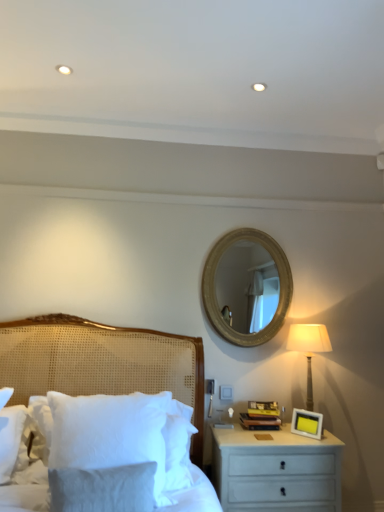
Question: Can you confirm if white painted wood nightstand at lower right is taller than white woven bed at left?

Choices:
 (A) no
 (B) yes

Answer: (A)

Question: Considering the relative positions of white painted wood nightstand at lower right and white woven bed at left in the image provided, is white painted wood nightstand at lower right behind white woven bed at left?

Choices:
 (A) no
 (B) yes

Answer: (B)

Question: Does white painted wood nightstand at lower right have a lesser width compared to white woven bed at left?

Choices:
 (A) yes
 (B) no

Answer: (B)

Question: Is white painted wood nightstand at lower right facing towards white woven bed at left?

Choices:
 (A) no
 (B) yes

Answer: (A)

Question: Does white painted wood nightstand at lower right appear on the left side of white woven bed at left?

Choices:
 (A) yes
 (B) no

Answer: (B)

Question: From a real-world perspective, relative to white fluffy pillow at lower left, is gold textured mirror at upper center vertically above or below?

Choices:
 (A) below
 (B) above

Answer: (B)

Question: Considering the relative positions of gold textured mirror at upper center and white fluffy pillow at lower left in the image provided, is gold textured mirror at upper center to the left or to the right of white fluffy pillow at lower left?

Choices:
 (A) left
 (B) right

Answer: (B)

Question: Considering the positions of gold textured mirror at upper center and white fluffy pillow at lower left in the image, is gold textured mirror at upper center wider or thinner than white fluffy pillow at lower left?

Choices:
 (A) wide
 (B) thin

Answer: (B)

Question: Is point (226, 302) closer or farther from the camera than point (155, 453)?

Choices:
 (A) farther
 (B) closer

Answer: (A)

Question: Considering the positions of yellow matte picture frame at right and gold textured mirror at upper center in the image, is yellow matte picture frame at right taller or shorter than gold textured mirror at upper center?

Choices:
 (A) tall
 (B) short

Answer: (B)

Question: Choose the correct answer: Is yellow matte picture frame at right inside gold textured mirror at upper center or outside it?

Choices:
 (A) inside
 (B) outside

Answer: (B)

Question: From the image's perspective, is yellow matte picture frame at right located above or below gold textured mirror at upper center?

Choices:
 (A) below
 (B) above

Answer: (A)

Question: Does point (292, 426) appear closer or farther from the camera than point (274, 266)?

Choices:
 (A) closer
 (B) farther

Answer: (A)

Question: In terms of size, does white woven bed at left appear bigger or smaller than yellow matte picture frame at right?

Choices:
 (A) big
 (B) small

Answer: (A)

Question: Is white woven bed at left wider or thinner than yellow matte picture frame at right?

Choices:
 (A) wide
 (B) thin

Answer: (A)